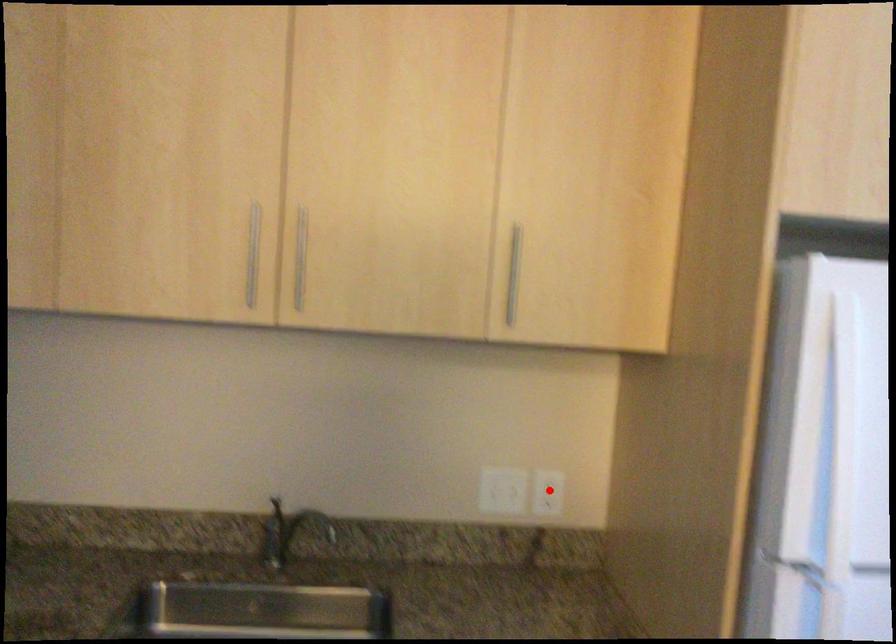
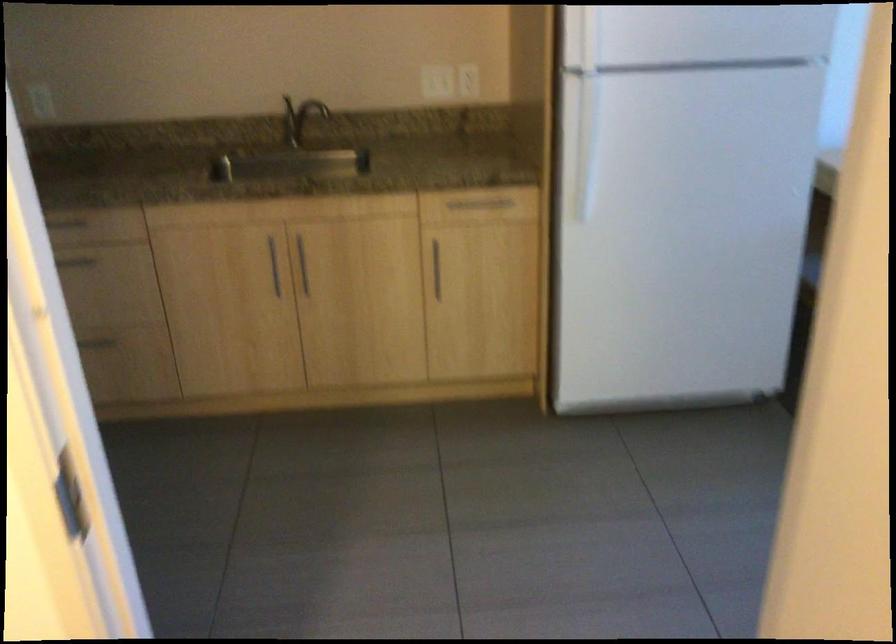
Question: I am providing you with two images of the same scene from different viewpoints. Image1 has a red point marked. In image2, the corresponding 3D location appears at what relative position? Reply with the corresponding letter.

Choices:
 (A) Closer
 (B) Farther

Answer: (B)